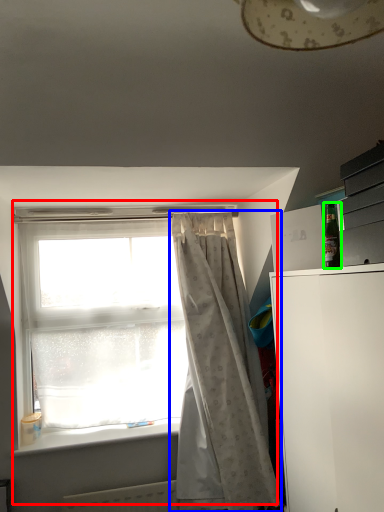
Question: Considering the real-world distances, which object is farthest from window (highlighted by a red box)? curtain (highlighted by a blue box) or bottle (highlighted by a green box)?

Choices:
 (A) curtain
 (B) bottle

Answer: (B)